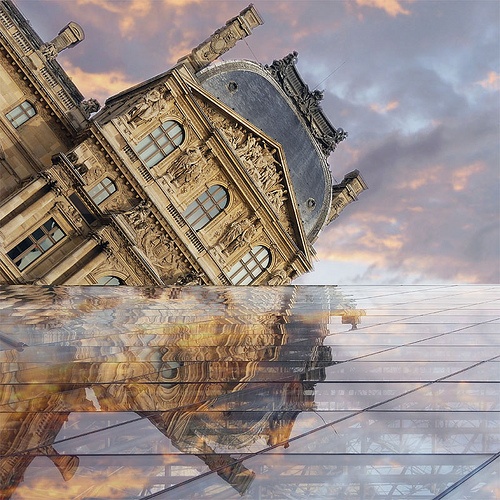
The image size is (500, 500). In order to click on sculptures in this screenshot , I will do `click(261, 162)`, `click(245, 147)`, `click(272, 177)`.